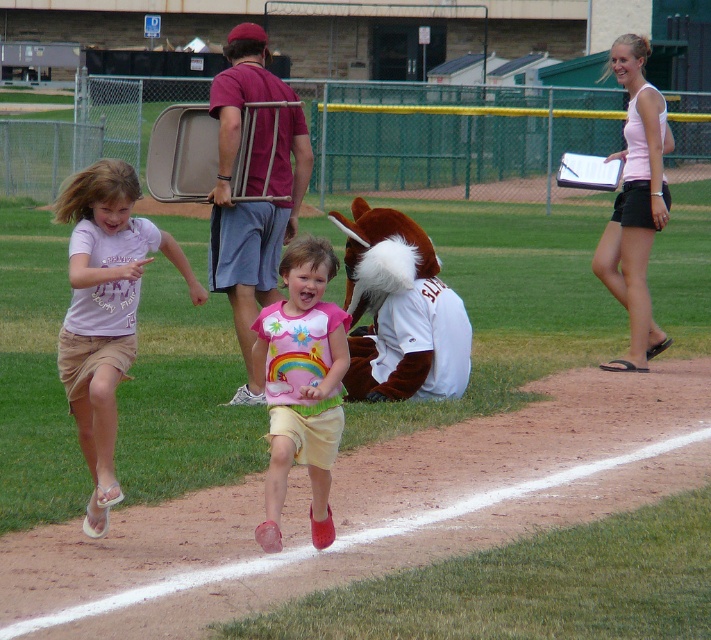
Can you confirm if beige cotton shorts at lower left is positioned to the right of pink fabric shirt at center?

Incorrect, beige cotton shorts at lower left is not on the right side of pink fabric shirt at center.

At what (x,y) coordinates should I click in order to perform the action: click on beige cotton shorts at lower left. Please return your answer as a coordinate pair (x, y). The image size is (711, 640). Looking at the image, I should click on (105, 310).

Is point (235, 211) positioned behind point (653, 224)?

No, it is not.

Which of these two, matte pink shirt at center or pink fabric shirt at right, stands taller?

Standing taller between the two is pink fabric shirt at right.

In order to click on matte pink shirt at center in this screenshot , I will do `click(252, 188)`.

Find the location of `matte pink shirt at center`. matte pink shirt at center is located at coordinates (252, 188).

Between matte pink shirt at center and pink fabric shirt at center, which one is positioned higher?

matte pink shirt at center is above.

Does matte pink shirt at center come in front of pink fabric shirt at center?

No, it is not.

Find the location of a particular element. matte pink shirt at center is located at coordinates (252, 188).